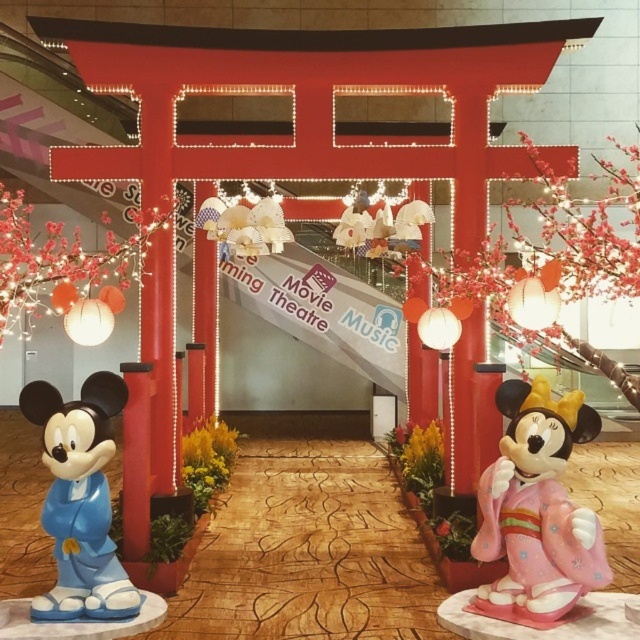
Is pink glossy minnie mouse statue at right above matte blue plastic mickey mouse at left?

Yes.

Is pink glossy minnie mouse statue at right behind matte blue plastic mickey mouse at left?

No, pink glossy minnie mouse statue at right is in front of matte blue plastic mickey mouse at left.

This screenshot has width=640, height=640. In order to click on pink glossy minnie mouse statue at right in this screenshot , I will do `click(538, 508)`.